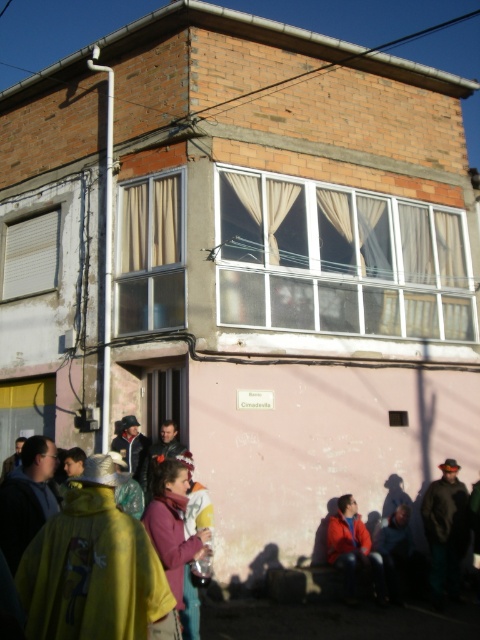
Question: Does white glass window at center have a smaller size compared to red matte jacket at lower right?

Choices:
 (A) yes
 (B) no

Answer: (B)

Question: Which object is positioned closest to the beige fabric curtain at upper left?

Choices:
 (A) yellow fabric cape at center
 (B) red matte jacket at lower right
 (C) white glass window at center
 (D) purple fleece jacket at lower center

Answer: (C)

Question: In this image, where is white glass window at center located relative to yellow fabric cape at center?

Choices:
 (A) right
 (B) left

Answer: (A)

Question: Which object appears closest to the camera in this image?

Choices:
 (A) yellow fabric cape at center
 (B) dark gray fabric jacket at lower right
 (C) white matte window at upper left

Answer: (A)

Question: Is dark gray fabric jacket at lower right bigger than red matte jacket at lower right?

Choices:
 (A) no
 (B) yes

Answer: (B)

Question: Which of the following is the farthest from the observer?

Choices:
 (A) pos(344,515)
 (B) pos(118,266)
 (C) pos(101,572)

Answer: (B)